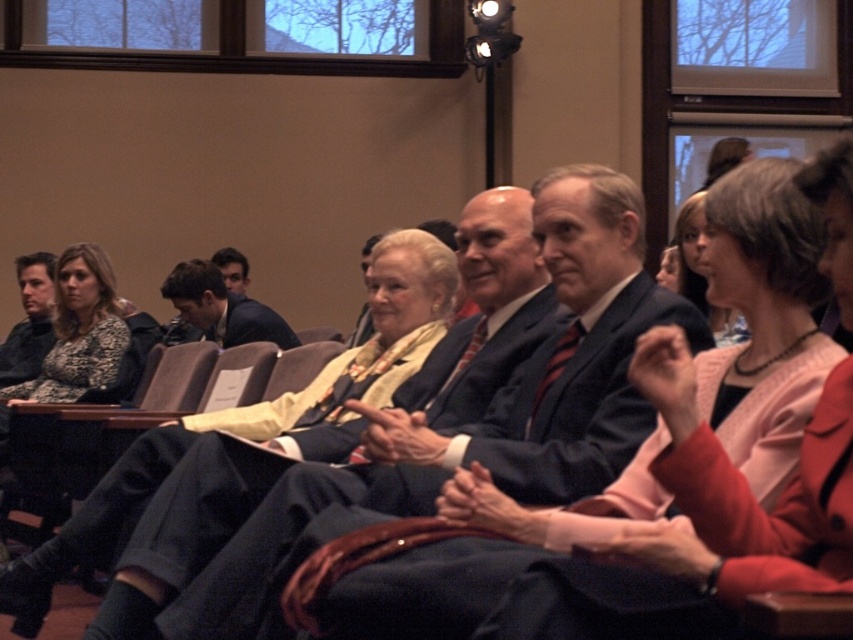
Question: Is matte black suit at center positioned at the back of dark blue suit at center?

Choices:
 (A) no
 (B) yes

Answer: (A)

Question: Which point is farther from the camera taking this photo?

Choices:
 (A) (502, 196)
 (B) (56, 376)
 (C) (215, 308)

Answer: (C)

Question: Considering the real-world distances, which object is closest to the dark blue suit at center?

Choices:
 (A) matte black suit at center
 (B) leopard print sweater at left

Answer: (B)

Question: From the image, what is the correct spatial relationship of matte black suit at center in relation to dark blue suit at center?

Choices:
 (A) above
 (B) below

Answer: (B)

Question: Considering the real-world distances, which object is closest to the leopard print sweater at left?

Choices:
 (A) matte black suit at center
 (B) dark blue suit at center

Answer: (B)

Question: Is matte black suit at center smaller than leopard print sweater at left?

Choices:
 (A) yes
 (B) no

Answer: (B)